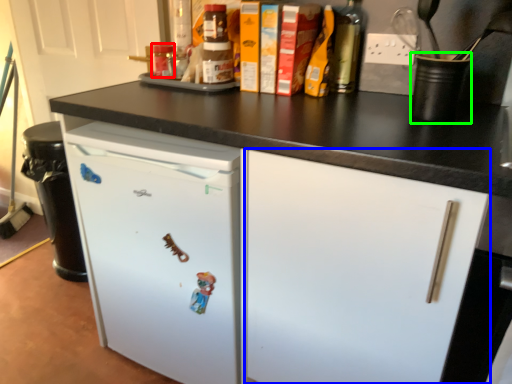
Question: Which object is the farthest from bottle (highlighted by a red box)? Choose among these: drawer (highlighted by a blue box) or appliance (highlighted by a green box).

Choices:
 (A) drawer
 (B) appliance

Answer: (A)